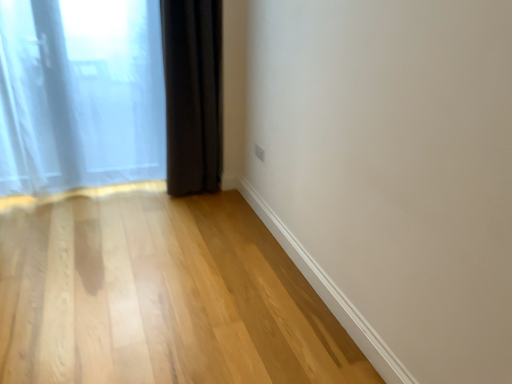
Question: Does point (192, 23) appear closer or farther from the camera than point (81, 201)?

Choices:
 (A) farther
 (B) closer

Answer: (B)

Question: Is dark matte curtain at lower left, which ranks as the first curtain in right-to-left order, situated inside light wood floor at lower left or outside?

Choices:
 (A) inside
 (B) outside

Answer: (B)

Question: Which object is positioned farthest from the light wood floor at lower left?

Choices:
 (A) translucent fabric curtain at left, marked as the 1th curtain in a left-to-right arrangement
 (B) dark matte curtain at lower left, acting as the 2th curtain starting from the left

Answer: (B)

Question: Estimate the real-world distances between objects in this image. Which object is closer to the dark matte curtain at lower left, which ranks as the first curtain in right-to-left order?

Choices:
 (A) translucent fabric curtain at left, marked as the 1th curtain in a left-to-right arrangement
 (B) light wood floor at lower left

Answer: (A)